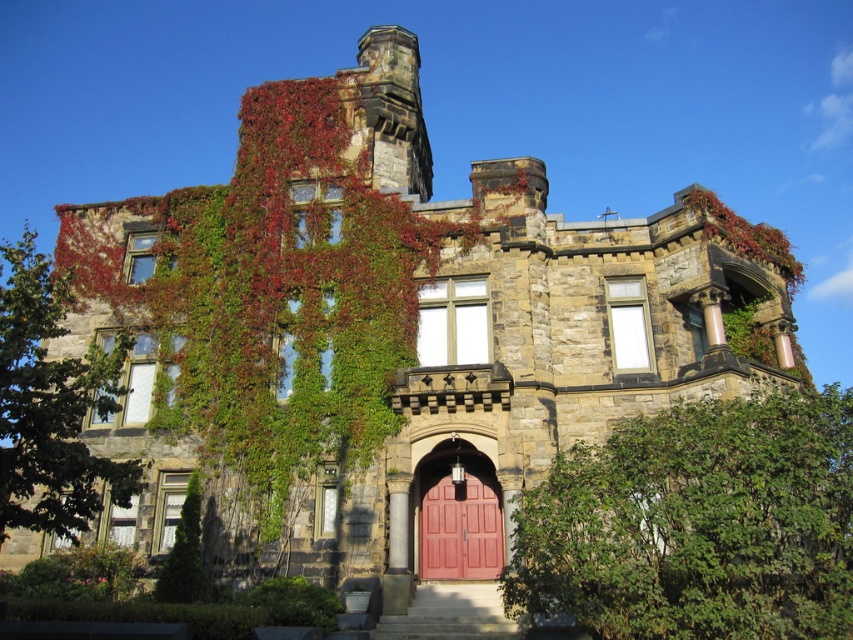
Question: Does green leafy ivy at right have a larger size compared to matte wood door at center?

Choices:
 (A) yes
 (B) no

Answer: (A)

Question: Does green leafy ivy at right come in front of matte wood door at center?

Choices:
 (A) yes
 (B) no

Answer: (A)

Question: Does green leafy ivy at right come behind matte wood door at center?

Choices:
 (A) no
 (B) yes

Answer: (A)

Question: Which point is farther from the camera taking this photo?

Choices:
 (A) tap(456, 524)
 (B) tap(700, 541)

Answer: (A)